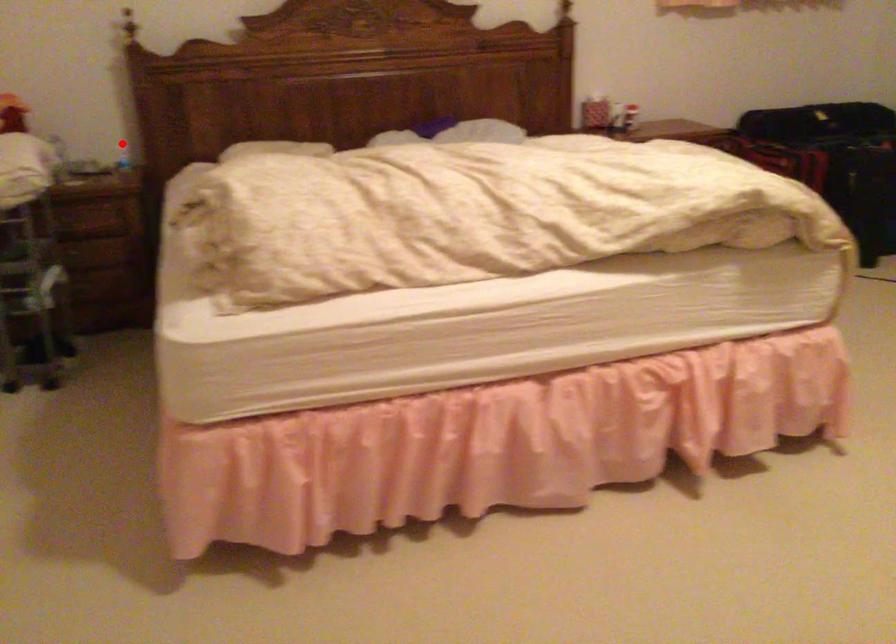
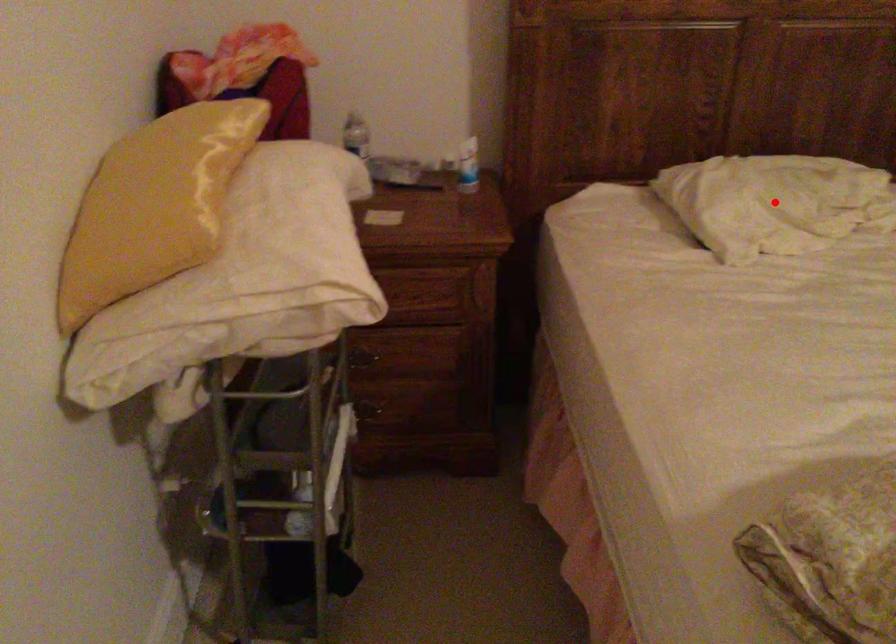
I am providing you with two images of the same scene from different viewpoints. A red point is marked on the first image and another point is marked on the second image. Is the marked point in image1 the same physical position as the marked point in image2?

No